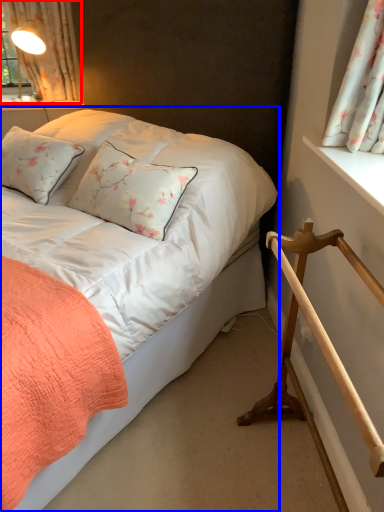
Question: Which object is further to the camera taking this photo, curtain (highlighted by a red box) or bed (highlighted by a blue box)?

Choices:
 (A) curtain
 (B) bed

Answer: (A)